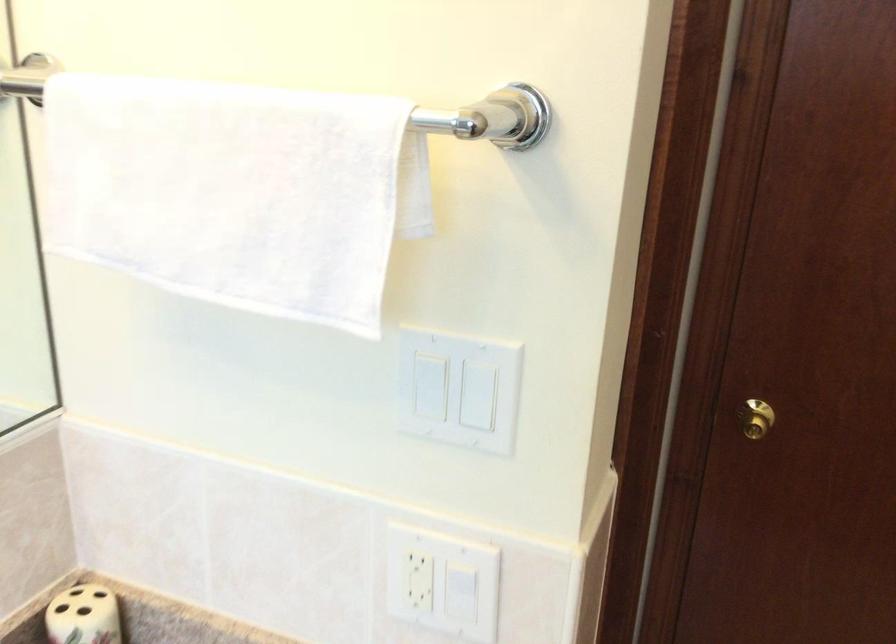
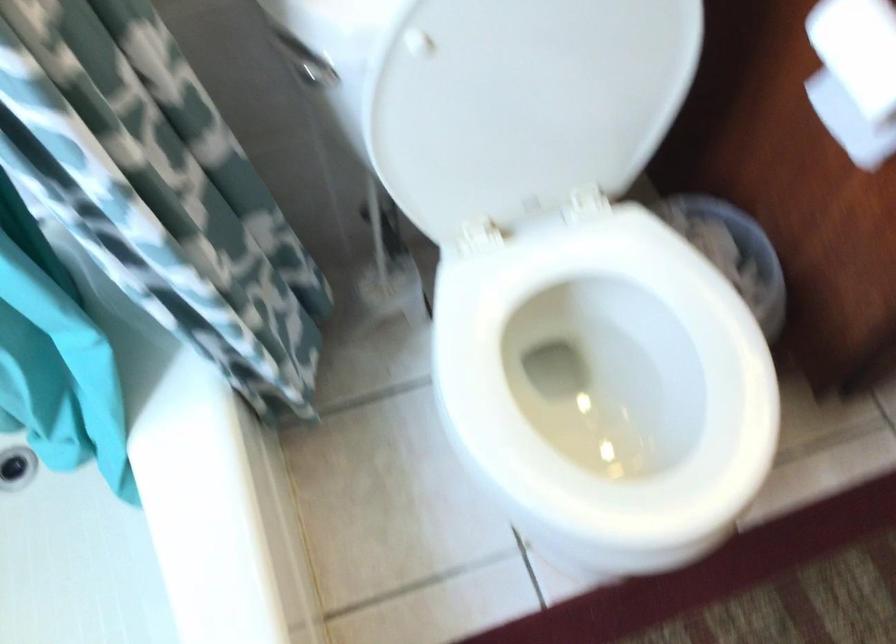
Based on the continuous images, in which direction is the camera rotating?

The camera's rotation is toward left-down.